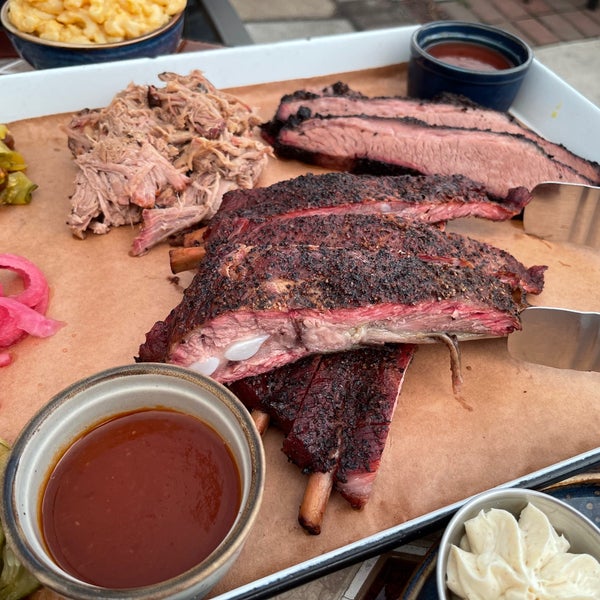
Where is `floor`? The width and height of the screenshot is (600, 600). floor is located at coordinates (535, 20).